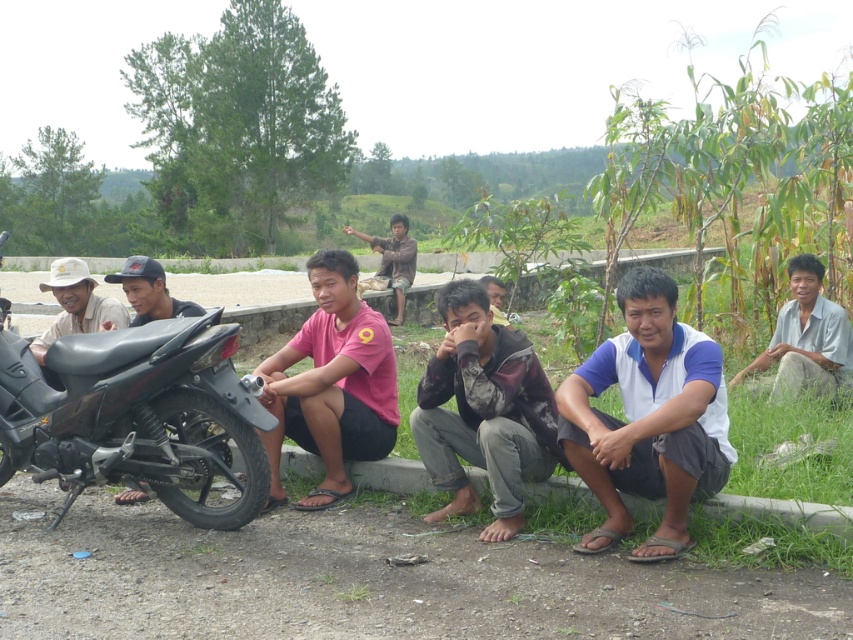
Question: Can you confirm if matte white hat at left is positioned below glossy black motorcycle at left?

Choices:
 (A) yes
 (B) no

Answer: (B)

Question: From the image, what is the correct spatial relationship of white cotton shirt at center in relation to brown cotton shirt at center?

Choices:
 (A) below
 (B) above

Answer: (A)

Question: Is camouflage fabric shirt at center to the right of brown cotton shirt at center from the viewer's perspective?

Choices:
 (A) no
 (B) yes

Answer: (B)

Question: Which object is closer to the camera taking this photo?

Choices:
 (A) brown cotton shirt at center
 (B) glossy black motorcycle at left
 (C) white cotton shirt at center

Answer: (C)

Question: Which point is closer to the camera?

Choices:
 (A) (488, 356)
 (B) (105, 330)
 (C) (140, 292)

Answer: (A)

Question: Which point is farther from the camera taking this photo?

Choices:
 (A) (67, 289)
 (B) (68, 433)
 (C) (836, 339)

Answer: (C)